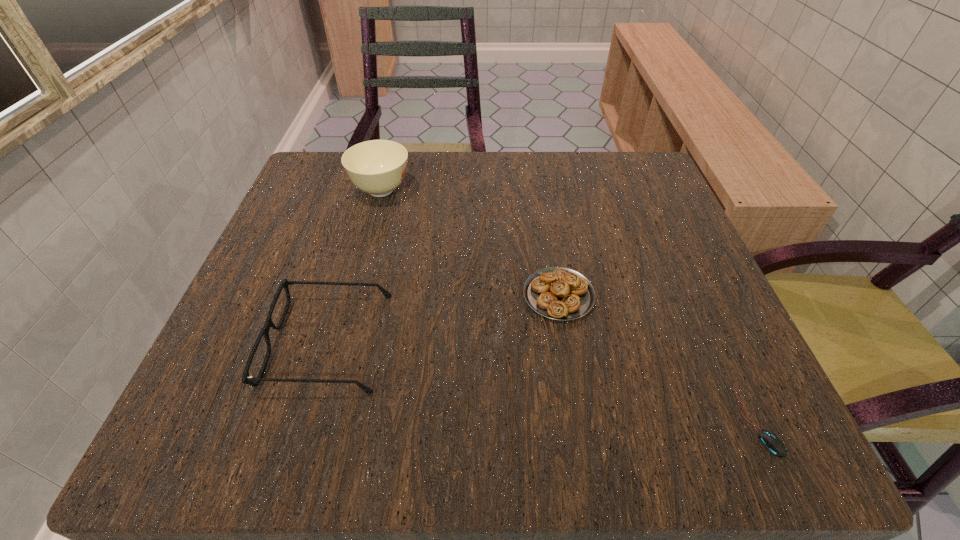
You are a GUI agent. You are given a task and a screenshot of the screen. Output one action in this format:
    pyautogui.click(x=<x>, y=<y>)
    Task: Click on the object that is at the near right corner
    
    Given the screenshot: What is the action you would take?
    pyautogui.click(x=771, y=442)

In the image, there is a desktop. Where is `vacant region at the far edge`? Image resolution: width=960 pixels, height=540 pixels. vacant region at the far edge is located at coordinates (571, 161).

You are a GUI agent. You are given a task and a screenshot of the screen. Output one action in this format:
    pyautogui.click(x=<x>, y=<y>)
    Task: Click on the vacant region at the left edge of the desktop
    
    Given the screenshot: What is the action you would take?
    pyautogui.click(x=324, y=239)

The width and height of the screenshot is (960, 540). In order to click on free space at the right edge of the desktop in this screenshot , I will do pos(655,261).

The height and width of the screenshot is (540, 960). In the image, there is a desktop. In order to click on free space at the far left corner in this screenshot , I will do `click(336, 176)`.

In the image, there is a desktop. Identify the location of free space at the far right corner. This screenshot has height=540, width=960. (612, 192).

Locate an element on the screen. This screenshot has width=960, height=540. vacant space that's between the second object from right to left and the tallest object is located at coordinates (469, 242).

At what (x,y) coordinates should I click in order to perform the action: click on vacant space that is in between the third tallest object and the spectacles. Please return your answer as a coordinate pair (x, y). Looking at the image, I should click on (444, 318).

I want to click on empty space that is in between the second tallest object and the tallest object, so click(x=354, y=266).

This screenshot has height=540, width=960. Identify the location of free space between the spectacles and the pastry. (444, 318).